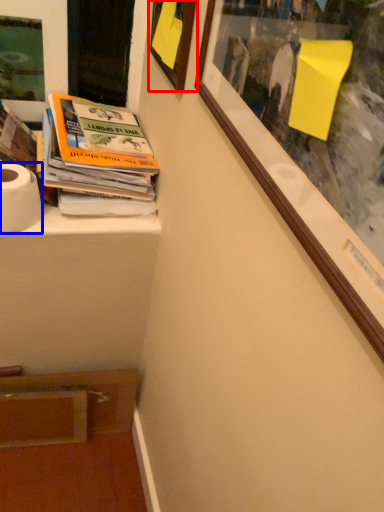
Question: Which object appears closest to the camera in this image, picture frame (highlighted by a red box) or toilet paper (highlighted by a blue box)?

Choices:
 (A) picture frame
 (B) toilet paper

Answer: (A)